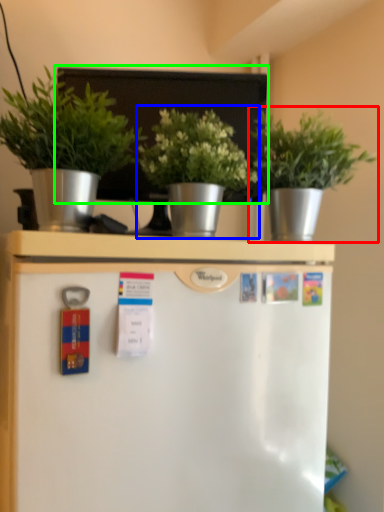
Question: Considering the real-world distances, which object is closest to houseplant (highlighted by a red box)? houseplant (highlighted by a blue box) or bulletin board (highlighted by a green box).

Choices:
 (A) houseplant
 (B) bulletin board

Answer: (A)